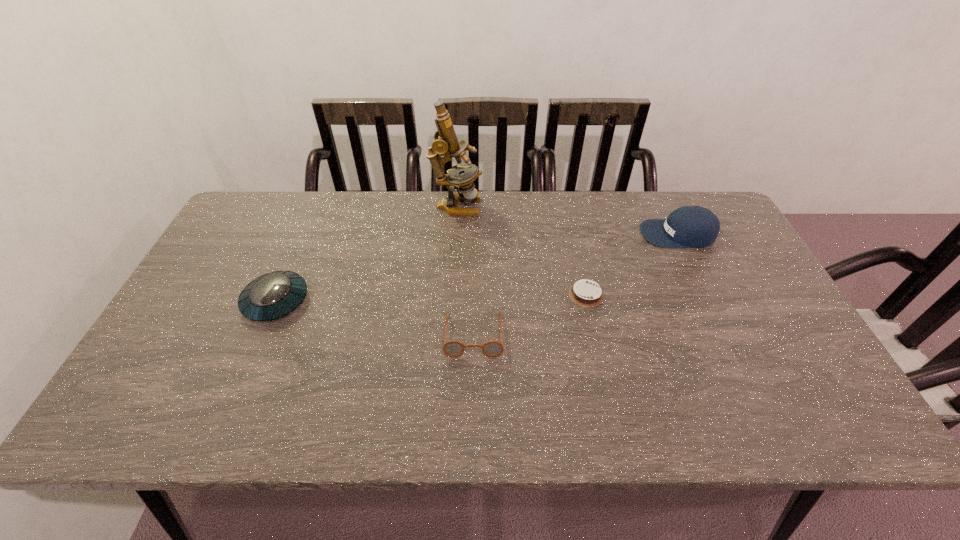
The width and height of the screenshot is (960, 540). Find the location of `free location located 0.090m on the front-facing side of the baseball cap`. free location located 0.090m on the front-facing side of the baseball cap is located at coordinates (612, 234).

You are a GUI agent. You are given a task and a screenshot of the screen. Output one action in this format:
    pyautogui.click(x=<x>, y=<y>)
    Task: Click on the blank area located on the front-facing side of the baseball cap
    The height and width of the screenshot is (540, 960).
    Given the screenshot: What is the action you would take?
    [x=570, y=234]

You are a GUI agent. You are given a task and a screenshot of the screen. Output one action in this format:
    pyautogui.click(x=<x>, y=<y>)
    Task: Click on the free space located 0.130m on the front of the saucer
    This screenshot has height=540, width=960.
    Given the screenshot: What is the action you would take?
    pyautogui.click(x=247, y=371)

You are a GUI agent. You are given a task and a screenshot of the screen. Output one action in this format:
    pyautogui.click(x=<x>, y=<y>)
    Task: Click on the blank area located on the front of the chocolate cake
    
    Given the screenshot: What is the action you would take?
    pos(606,381)

You are a GUI agent. You are given a task and a screenshot of the screen. Output one action in this format:
    pyautogui.click(x=<x>, y=<y>)
    Task: Click on the microscope that is at the far edge
    This screenshot has height=540, width=960.
    Given the screenshot: What is the action you would take?
    pyautogui.click(x=446, y=142)

Locate an element on the screen. The height and width of the screenshot is (540, 960). baseball cap located at the far edge is located at coordinates click(689, 226).

This screenshot has width=960, height=540. Find the location of `object that is at the left edge`. object that is at the left edge is located at coordinates click(273, 295).

Where is `object present at the right edge`? This screenshot has height=540, width=960. object present at the right edge is located at coordinates (689, 226).

Find the location of a particular element. Image resolution: width=960 pixels, height=540 pixels. object positioned at the far right corner is located at coordinates (689, 226).

This screenshot has width=960, height=540. In order to click on vacant space at the far edge of the desktop in this screenshot , I will do `click(518, 219)`.